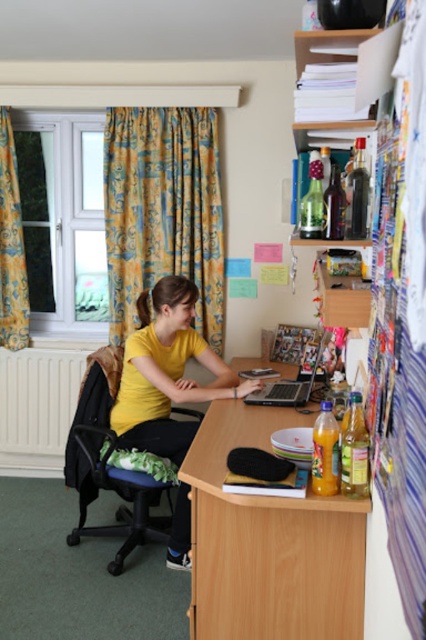
Question: Among these points, which one is farthest from the camera?

Choices:
 (A) (83, 442)
 (B) (124, 118)
 (C) (268, 388)

Answer: (B)

Question: Does wooden at center appear under yellow matte shirt at center?

Choices:
 (A) yes
 (B) no

Answer: (A)

Question: Does wooden at center come in front of satin silver laptop at center?

Choices:
 (A) yes
 (B) no

Answer: (A)

Question: Does yellow matte shirt at center appear on the right side of satin silver laptop at center?

Choices:
 (A) no
 (B) yes

Answer: (A)

Question: Which object is farther from the camera taking this photo?

Choices:
 (A) wooden at center
 (B) yellow patterned curtain at upper left
 (C) yellow patterned curtain at left
 (D) green fabric swivel chair at left

Answer: (C)

Question: Which object is farther from the camera taking this photo?

Choices:
 (A) yellow patterned curtain at left
 (B) yellow matte shirt at center
 (C) green fabric swivel chair at left
 (D) yellow patterned curtain at upper left

Answer: (A)